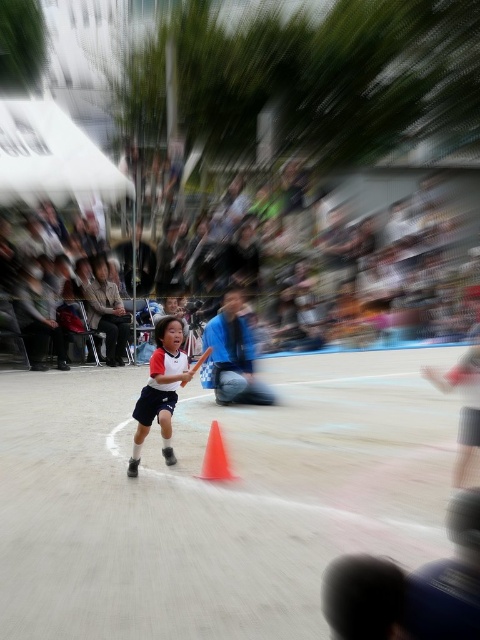
Between blurred plastic chairs at upper center and wooden baseball bat at center, which one has more height?

blurred plastic chairs at upper center

Is blurred plastic chairs at upper center closer to camera compared to wooden baseball bat at center?

No.

Is point (260, 196) in front of point (183, 381)?

That is False.

You are a GUI agent. You are given a task and a screenshot of the screen. Output one action in this format:
    pyautogui.click(x=<x>, y=<y>)
    Task: Click on the blurred plastic chairs at upper center
    
    Given the screenshot: What is the action you would take?
    pyautogui.click(x=342, y=259)

Is smooth asphalt track at center above wooden baseball bat at center?

Incorrect, smooth asphalt track at center is not positioned above wooden baseball bat at center.

Does smooth asphalt track at center lie in front of wooden baseball bat at center?

That is False.

Locate an element on the screen. The image size is (480, 640). smooth asphalt track at center is located at coordinates (216, 497).

Is matte white shirt at center above wooden baseball bat at center?

Incorrect, matte white shirt at center is not positioned above wooden baseball bat at center.

Is matte white shirt at center wider than wooden baseball bat at center?

Indeed, matte white shirt at center has a greater width compared to wooden baseball bat at center.

Is point (175, 460) closer to camera compared to point (181, 387)?

No, it is behind (181, 387).

Locate an element on the screen. matte white shirt at center is located at coordinates (160, 388).